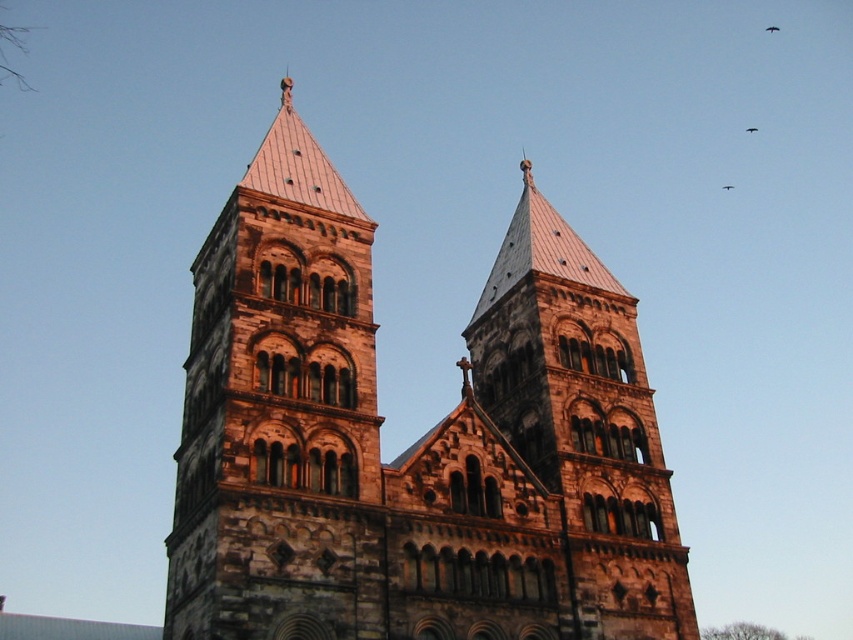
Question: Considering the relative positions of brown stone tower at left and rustic stone tower at center in the image provided, where is brown stone tower at left located with respect to rustic stone tower at center?

Choices:
 (A) left
 (B) right

Answer: (A)

Question: Observing the image, what is the correct spatial positioning of rustic stone tower at center in reference to black feathered bird at upper center?

Choices:
 (A) above
 (B) below

Answer: (B)

Question: Is brown stone church at center positioned before rustic stone tower at center?

Choices:
 (A) yes
 (B) no

Answer: (A)

Question: Among these objects, which one is nearest to the camera?

Choices:
 (A) brown stone church at center
 (B) brown stone tower at left
 (C) black feathered bird at upper center

Answer: (A)

Question: Which object is positioned closest to the brown stone church at center?

Choices:
 (A) black feathered bird at upper center
 (B) rustic stone tower at center

Answer: (B)

Question: Which point is closer to the camera taking this photo?

Choices:
 (A) (354, 600)
 (B) (376, 468)

Answer: (A)